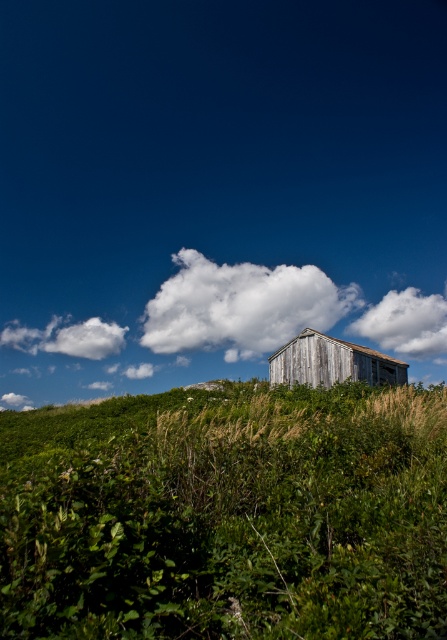
You are an artist planning to paint this rural landscape. You want to ensure that the green leafy grass at center and the white fluffy cloud at center are proportionally accurate. Which object should you make smaller in your painting?

The green leafy grass at center should be made smaller because it occupies less space than the white fluffy cloud at center in the scene.

In the scene shown: You are an architect designing a new ecofriendly building. You observe the white fluffy cloud at center and the weathered wood hut at center in the image. Which object has a greater width?

The white fluffy cloud at center has a greater width than the weathered wood hut at center.

You are a bird soaring in the sky and want to land on the weathered wood hut at center. Which direction should you fly to reach it from the white fluffy cloud at center?

The white fluffy cloud at center is located above the weathered wood hut at center, so to land on the weathered wood hut at center, you should fly downward from the white fluffy cloud at center.